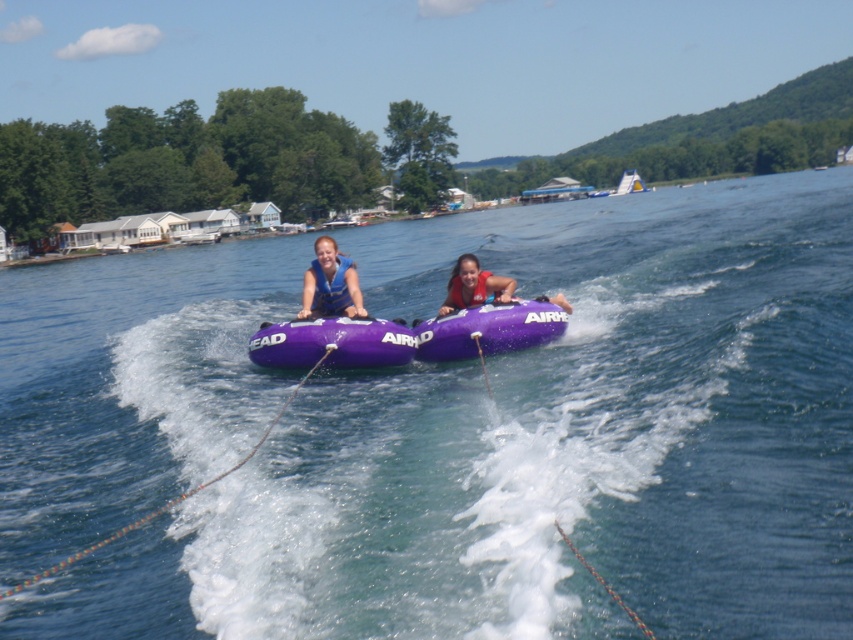
You are a safety inspector checking the equipment of two people on the lake. You notice the matte blue life vest at center and the purple rubber tube at center. Based on their sizes, which one is more likely to provide adequate buoyancy for a person?

The matte blue life vest at center is much taller than the purple rubber tube at center, so it is more likely to provide adequate buoyancy for a person.

You are a photographer trying to capture the purple rubber tubes at center in the image. Based on their 2D coordinates, would you position your camera to the left or right of the tubes to ensure they are centered in your shot?

The purple rubber tubes at center are already positioned at the center of the image according to their 2D coordinates, so you should position your camera directly in front of them to keep them centered.

You are a safety inspector checking the equipment for two people on purple rubber tube at center and purple fabric life jacket at center. Which equipment has a larger width?

The purple rubber tube at center has a larger width than the purple fabric life jacket at center.